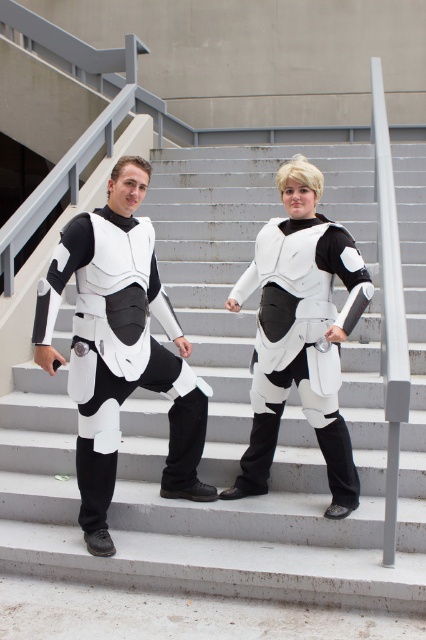
Question: Is matte white armor at center bigger than white matte armor at center?

Choices:
 (A) no
 (B) yes

Answer: (B)

Question: Does white smooth stairs at center appear on the right side of white matte armor at center?

Choices:
 (A) yes
 (B) no

Answer: (B)

Question: Does white smooth stairs at center lie behind white matte armor at center?

Choices:
 (A) yes
 (B) no

Answer: (B)

Question: Which point appears farthest from the camera in this image?

Choices:
 (A) (88, 225)
 (B) (308, 426)
 (C) (310, 356)

Answer: (B)

Question: Which point is closer to the camera?

Choices:
 (A) (267, 392)
 (B) (203, 244)

Answer: (A)

Question: Which point appears farthest from the camera in this image?

Choices:
 (A) (121, 554)
 (B) (236, 296)
 (C) (103, 548)

Answer: (B)